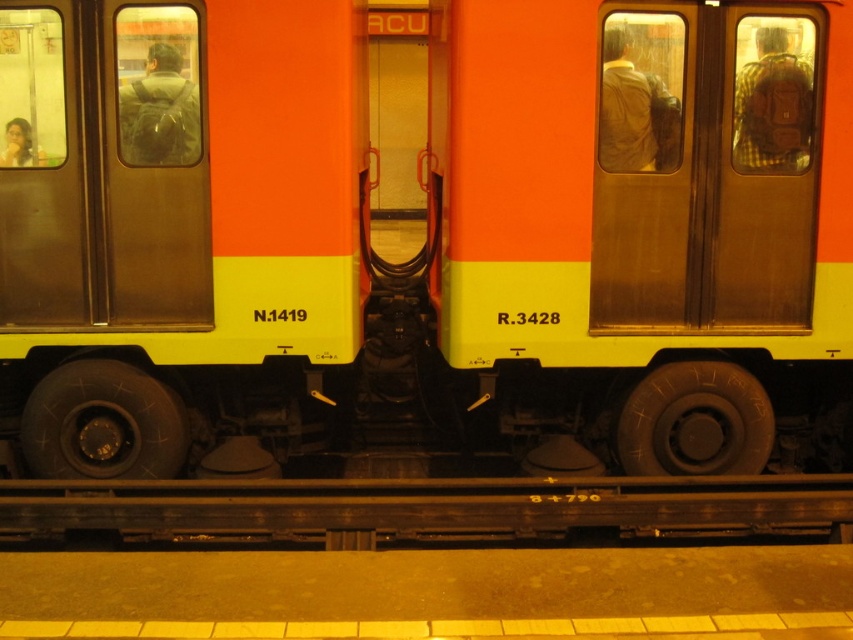
Is point (798, 108) positioned before point (343, 531)?

No, it is not.

At what (x,y) coordinates should I click in order to perform the action: click on metallic gold door at right. Please return your answer as a coordinate pair (x, y). The height and width of the screenshot is (640, 853). Looking at the image, I should click on (705, 168).

Who is more forward, (x=698, y=310) or (x=827, y=518)?

Point (x=827, y=518) is in front.

This screenshot has width=853, height=640. Identify the location of metallic gold door at right. (705, 168).